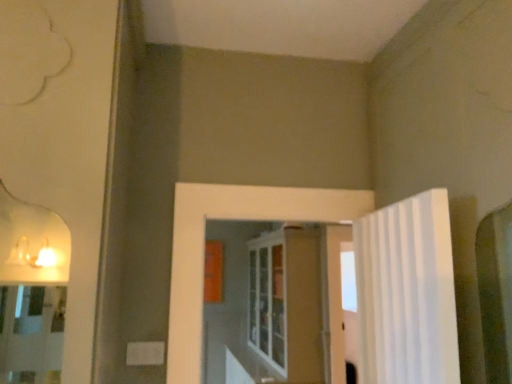
Question: From the image's perspective, is white striped fabric at right on white glass cabinet at center?

Choices:
 (A) yes
 (B) no

Answer: (A)

Question: Is white striped fabric at right facing away from white glass cabinet at center?

Choices:
 (A) no
 (B) yes

Answer: (A)

Question: Considering the relative sizes of white striped fabric at right and white glass cabinet at center in the image provided, is white striped fabric at right bigger than white glass cabinet at center?

Choices:
 (A) yes
 (B) no

Answer: (B)

Question: Is white striped fabric at right closer to camera compared to white glass cabinet at center?

Choices:
 (A) yes
 (B) no

Answer: (A)

Question: Is white striped fabric at right wider than white glass cabinet at center?

Choices:
 (A) no
 (B) yes

Answer: (A)

Question: Is white striped fabric at right facing towards white glass cabinet at center?

Choices:
 (A) yes
 (B) no

Answer: (B)

Question: Could you tell me if white glass cabinet at center is facing white striped fabric at right?

Choices:
 (A) no
 (B) yes

Answer: (A)

Question: Can you confirm if white glass cabinet at center is positioned to the right of white striped fabric at right?

Choices:
 (A) no
 (B) yes

Answer: (A)

Question: Is white striped fabric at right located within white glass cabinet at center?

Choices:
 (A) no
 (B) yes

Answer: (A)

Question: Can you confirm if white glass cabinet at center is positioned to the left of white striped fabric at right?

Choices:
 (A) no
 (B) yes

Answer: (B)

Question: Is white glass cabinet at center far away from white striped fabric at right?

Choices:
 (A) no
 (B) yes

Answer: (B)

Question: From a real-world perspective, is white glass cabinet at center on white striped fabric at right?

Choices:
 (A) yes
 (B) no

Answer: (B)

Question: Choose the correct answer: Is white glass cabinet at center inside white striped fabric at right or outside it?

Choices:
 (A) inside
 (B) outside

Answer: (B)